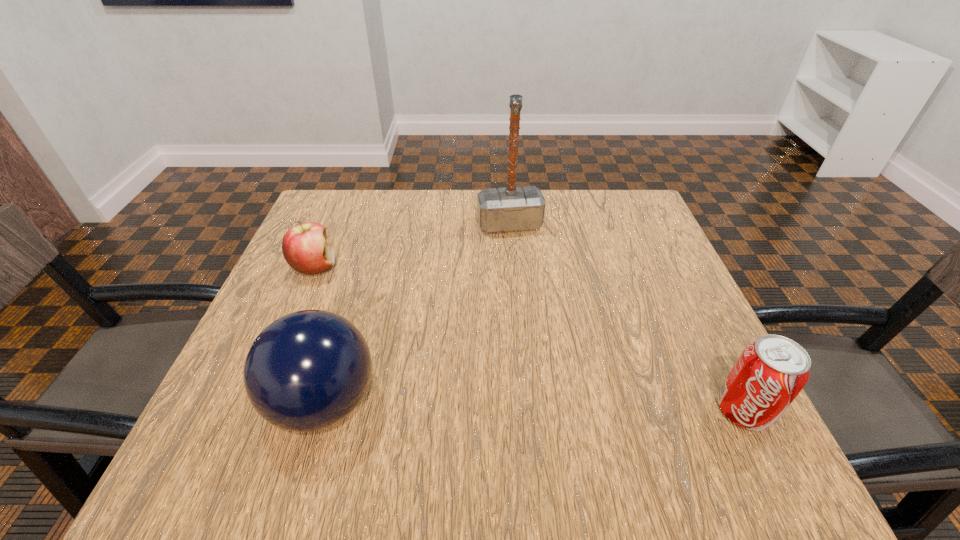
The width and height of the screenshot is (960, 540). Identify the location of free space on the desktop that is between the bowling ball and the third tallest object and is positioned on the bitten side of the shortest object. (572, 407).

Identify the location of vacant spot on the desktop that is between the second tallest object and the soda and is positioned on the striking surface of the second object from right to left. (563, 407).